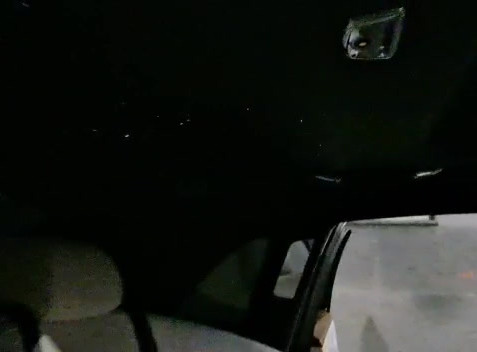
Find the location of a particular element. The image size is (477, 352). light is located at coordinates click(x=439, y=167), click(x=337, y=168).